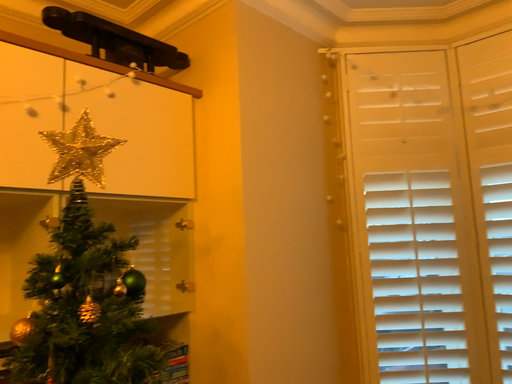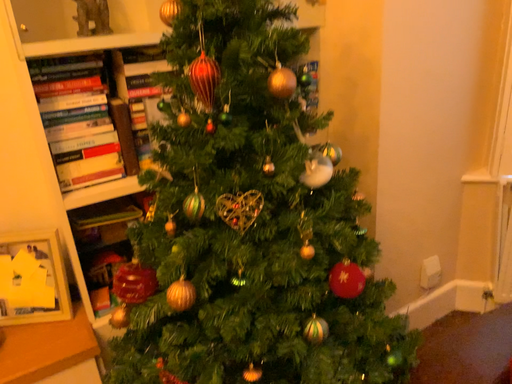
Question: How did the camera likely rotate when shooting the video?

Choices:
 (A) rotated upward
 (B) rotated downward

Answer: (B)